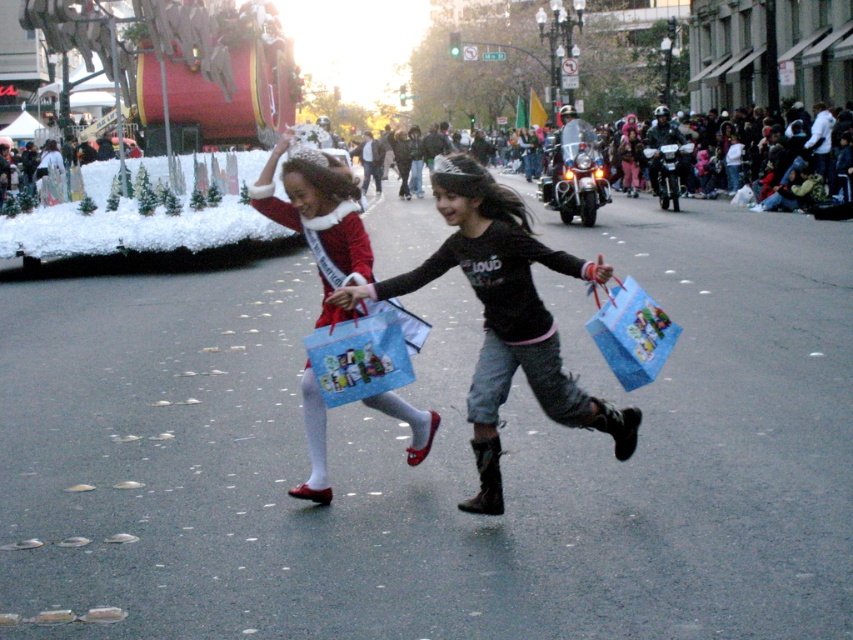
Question: Which point is farther to the camera?

Choices:
 (A) matte red dress at center
 (B) matte black boots at center

Answer: (A)

Question: Can you confirm if matte black boots at center is wider than matte red dress at center?

Choices:
 (A) no
 (B) yes

Answer: (B)

Question: Can you confirm if matte black boots at center is positioned to the right of matte red dress at center?

Choices:
 (A) yes
 (B) no

Answer: (A)

Question: Which object appears closest to the camera in this image?

Choices:
 (A) matte black boots at center
 (B) matte red dress at center

Answer: (A)

Question: Does matte black boots at center have a smaller size compared to matte red dress at center?

Choices:
 (A) yes
 (B) no

Answer: (B)